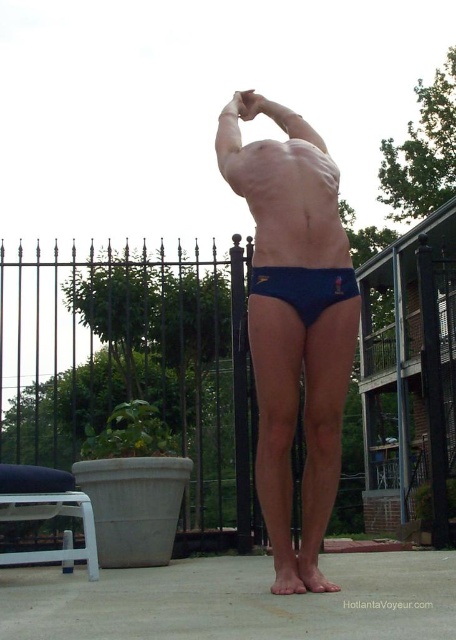
Is point (320, 228) positioned in front of point (352, 269)?

Yes, it is.

Who is more distant from viewer, (310, 548) or (341, 273)?

Point (310, 548)

Is point (348, 378) positioned after point (255, 285)?

Yes, point (348, 378) is farther from viewer.

I want to click on blue matte underwear at center, so click(x=295, y=426).